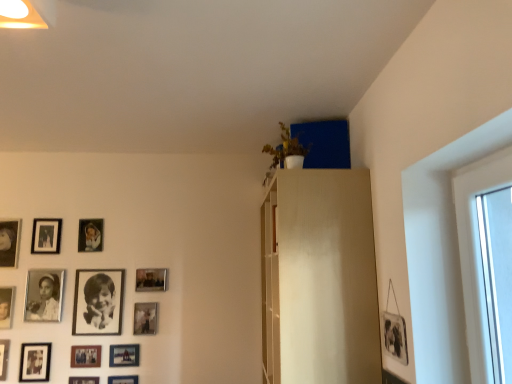
Question: Would you say black matte photo frame at lower left, the 9th picture frame positioned from the right, is outside matte black picture frame at upper left, placed as the 8th picture frame when sorted from right to left?

Choices:
 (A) no
 (B) yes

Answer: (B)

Question: Considering the relative positions of black matte photo frame at lower left, which is the sixth picture frame from left to right, and matte black picture frame at upper left, which is the 7th picture frame from left to right, in the image provided, is black matte photo frame at lower left, which is the sixth picture frame from left to right, to the right of matte black picture frame at upper left, which is the 7th picture frame from left to right, from the viewer's perspective?

Choices:
 (A) no
 (B) yes

Answer: (A)

Question: Is black matte photo frame at lower left, the 9th picture frame positioned from the right, oriented towards matte black picture frame at upper left, placed as the 8th picture frame when sorted from right to left?

Choices:
 (A) no
 (B) yes

Answer: (A)

Question: From the image's perspective, is black matte photo frame at lower left, which is the sixth picture frame from left to right, under matte black picture frame at upper left, placed as the 8th picture frame when sorted from right to left?

Choices:
 (A) yes
 (B) no

Answer: (A)

Question: Is black matte photo frame at lower left, which is the sixth picture frame from left to right, closer to camera compared to matte black picture frame at upper left, which is the 7th picture frame from left to right?

Choices:
 (A) no
 (B) yes

Answer: (B)

Question: From the image's perspective, relative to matte black picture frame at lower left, arranged as the 9th picture frame when viewed from the left, is matte black picture frame at upper left, marked as the 5th picture frame in a left-to-right arrangement, above or below?

Choices:
 (A) above
 (B) below

Answer: (A)

Question: Does point (33, 230) appear closer or farther from the camera than point (87, 357)?

Choices:
 (A) closer
 (B) farther

Answer: (B)

Question: From a real-world perspective, is matte black picture frame at upper left, arranged as the 10th picture frame when viewed from the right, above or below matte black picture frame at lower left, arranged as the 9th picture frame when viewed from the left?

Choices:
 (A) above
 (B) below

Answer: (A)

Question: In terms of height, does matte black picture frame at upper left, arranged as the 10th picture frame when viewed from the right, look taller or shorter compared to matte black picture frame at lower left, the 6th picture frame in the right-to-left sequence?

Choices:
 (A) short
 (B) tall

Answer: (B)

Question: Visually, is matte black picture frame at lower center, the third picture frame viewed from the right, positioned to the left or to the right of matte wood dresser at upper center?

Choices:
 (A) left
 (B) right

Answer: (A)

Question: From their relative heights in the image, would you say matte black picture frame at lower center, the twelfth picture frame when ordered from left to right, is taller or shorter than matte wood dresser at upper center?

Choices:
 (A) tall
 (B) short

Answer: (B)

Question: From the image's perspective, is matte black picture frame at lower center, the third picture frame viewed from the right, positioned above or below matte wood dresser at upper center?

Choices:
 (A) above
 (B) below

Answer: (B)

Question: Is matte black picture frame at lower center, the twelfth picture frame when ordered from left to right, inside the boundaries of matte wood dresser at upper center, or outside?

Choices:
 (A) outside
 (B) inside

Answer: (A)

Question: From the image's perspective, is matte black picture frame at lower left, the 6th picture frame in the right-to-left sequence, above or below matte black photo frame at lower left, marked as the 2th picture frame in a left-to-right arrangement?

Choices:
 (A) above
 (B) below

Answer: (B)

Question: Considering the positions of matte black picture frame at lower left, the 6th picture frame in the right-to-left sequence, and matte black photo frame at lower left, marked as the 2th picture frame in a left-to-right arrangement, in the image, is matte black picture frame at lower left, the 6th picture frame in the right-to-left sequence, wider or thinner than matte black photo frame at lower left, marked as the 2th picture frame in a left-to-right arrangement,?

Choices:
 (A) wide
 (B) thin

Answer: (B)